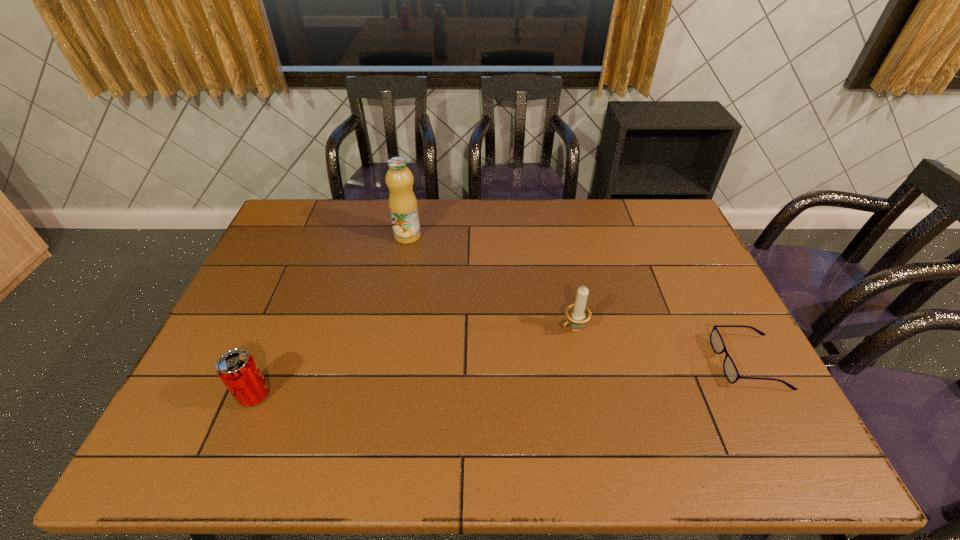
Locate an element on the screen. The width and height of the screenshot is (960, 540). object that is positioned at the right edge is located at coordinates (729, 367).

Where is `object positioned at the near left corner`? This screenshot has width=960, height=540. object positioned at the near left corner is located at coordinates (237, 369).

The width and height of the screenshot is (960, 540). In order to click on object that is at the near right corner in this screenshot , I will do `click(729, 367)`.

Find the location of a particular element. vacant region at the far edge of the desktop is located at coordinates (630, 225).

This screenshot has height=540, width=960. I want to click on vacant area at the near edge, so tap(545, 418).

This screenshot has width=960, height=540. Find the location of `vacant space at the left edge of the desktop`. vacant space at the left edge of the desktop is located at coordinates (294, 276).

Image resolution: width=960 pixels, height=540 pixels. Find the location of `vacant space at the right edge of the desktop`. vacant space at the right edge of the desktop is located at coordinates (703, 296).

Identify the location of free spot at the far left corner of the desktop. (278, 227).

The width and height of the screenshot is (960, 540). Find the location of `free spot at the near left corner of the desktop`. free spot at the near left corner of the desktop is located at coordinates (225, 416).

Where is `vacant space at the far right corner of the desktop`? vacant space at the far right corner of the desktop is located at coordinates (654, 201).